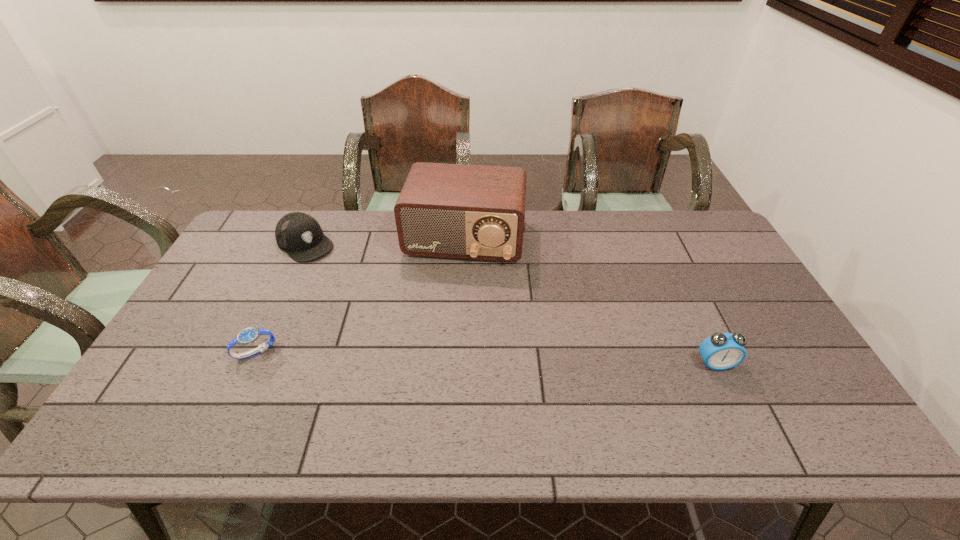
Identify the location of vacant region located 0.390m on the front panel of the second object from right to left. The image size is (960, 540). (436, 372).

Where is `vacant space located on the front panel of the second object from right to left`? Image resolution: width=960 pixels, height=540 pixels. vacant space located on the front panel of the second object from right to left is located at coordinates pyautogui.click(x=444, y=329).

Locate an element on the screen. This screenshot has width=960, height=540. vacant area located 0.180m on the front panel of the second object from right to left is located at coordinates (448, 311).

Find the location of a particular element. The height and width of the screenshot is (540, 960). cap present at the far edge is located at coordinates (298, 234).

What are the coordinates of `radio receiver that is at the far edge` in the screenshot? It's located at (462, 211).

The image size is (960, 540). Find the location of `object positioned at the left edge`. object positioned at the left edge is located at coordinates (298, 234).

This screenshot has width=960, height=540. Find the location of `object situated at the far left corner`. object situated at the far left corner is located at coordinates (298, 234).

Where is `free point at the far edge`? The width and height of the screenshot is (960, 540). free point at the far edge is located at coordinates (574, 222).

The width and height of the screenshot is (960, 540). I want to click on free space at the near edge of the desktop, so click(x=511, y=377).

Find the location of a particular element. Image resolution: width=960 pixels, height=540 pixels. free space at the left edge is located at coordinates (261, 269).